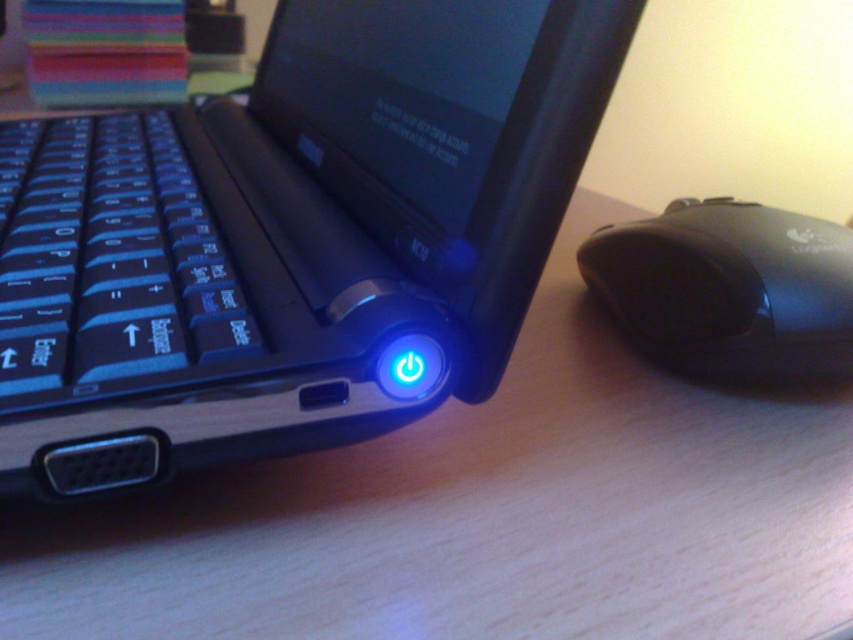
Is point (151, 349) positioned in front of point (711, 228)?

Yes, point (151, 349) is closer to viewer.

Can you confirm if blue matte keyboard at left is thinner than black plastic mouse at right?

No, blue matte keyboard at left is not thinner than black plastic mouse at right.

Identify the location of blue matte keyboard at left. click(x=109, y=262).

This screenshot has width=853, height=640. I want to click on blue matte keyboard at left, so click(109, 262).

From the picture: Is blue glossy power button at center positioned at the back of blue matte keyboard at left?

No, blue glossy power button at center is closer to the viewer.

Does point (556, 106) come in front of point (51, 282)?

Yes, it is.

The image size is (853, 640). I want to click on blue glossy power button at center, so click(291, 237).

Between blue glossy power button at center and black plastic mouse at right, which one is positioned lower?

black plastic mouse at right

Between blue glossy power button at center and black plastic mouse at right, which one appears on the right side from the viewer's perspective?

black plastic mouse at right is more to the right.

Where is `blue glossy power button at center`? This screenshot has height=640, width=853. blue glossy power button at center is located at coordinates (291, 237).